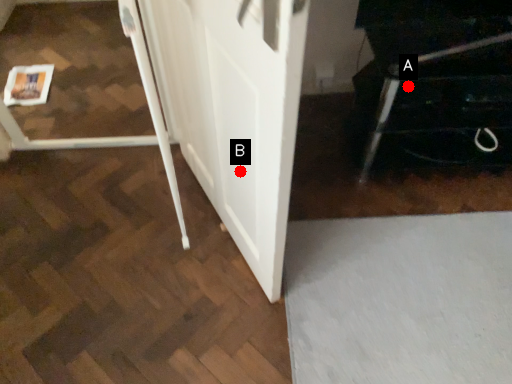
Question: Two points are circled on the image, labeled by A and B beside each circle. Which point is closer to the camera?

Choices:
 (A) A is closer
 (B) B is closer

Answer: (B)